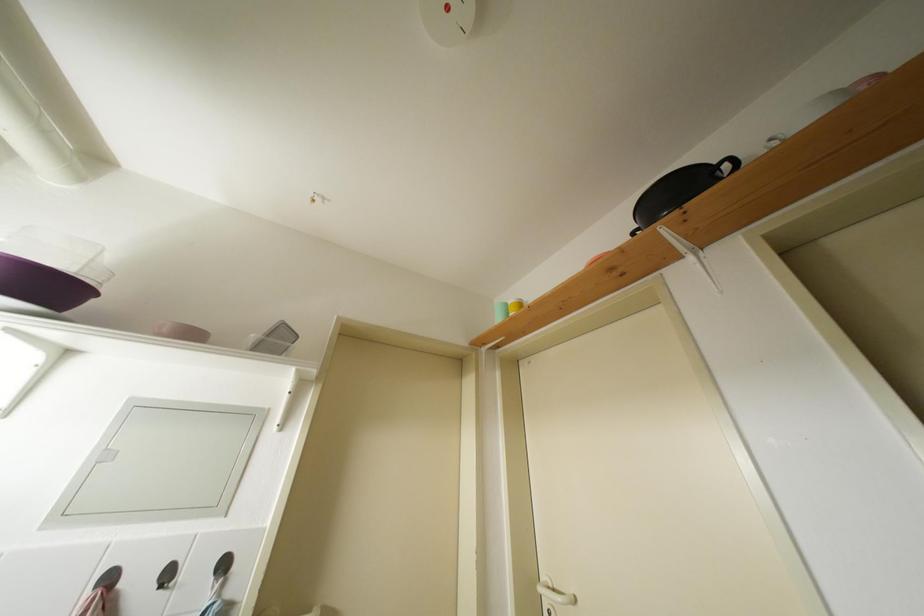
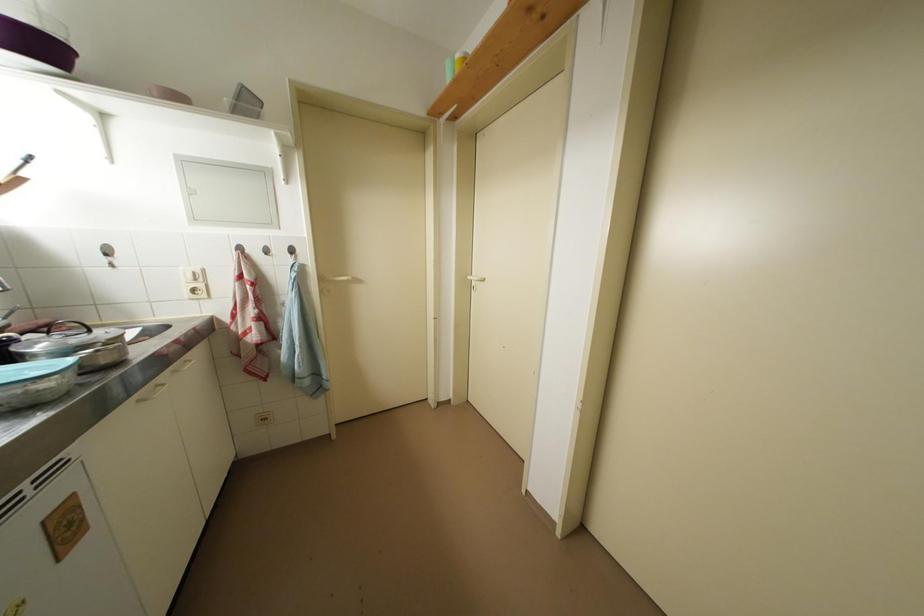
Find the pixel in the second image that matches [44,289] in the first image.

(38, 47)